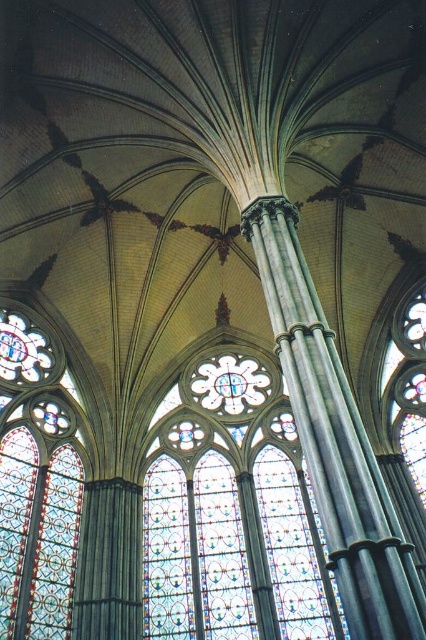
Is stained glass at center positioned at the back of polished stone column at center?

That is True.

Between stained glass at center and polished stone column at center, which one appears on the left side from the viewer's perspective?

From the viewer's perspective, stained glass at center appears more on the left side.

You are a GUI agent. You are given a task and a screenshot of the screen. Output one action in this format:
    pyautogui.click(x=<x>, y=<y>)
    Task: Click on the stained glass at center
    Image resolution: width=426 pixels, height=640 pixels.
    Given the screenshot: What is the action you would take?
    232,512

Between polished stone column at center and stained glass window at left, which one is positioned lower?

stained glass window at left is below.

Can you confirm if polished stone column at center is positioned to the right of stained glass window at left?

Yes, polished stone column at center is to the right of stained glass window at left.

Is point (339, 548) in front of point (37, 465)?

Yes, point (339, 548) is in front of point (37, 465).

What are the coordinates of `polished stone column at center` in the screenshot? It's located at (334, 440).

Is stained glass at center positioned before stained glass window at left?

No, stained glass at center is behind stained glass window at left.

Does stained glass at center appear on the right side of stained glass window at left?

Indeed, stained glass at center is positioned on the right side of stained glass window at left.

What do you see at coordinates (232, 512) in the screenshot? This screenshot has width=426, height=640. I see `stained glass at center` at bounding box center [232, 512].

The width and height of the screenshot is (426, 640). Identify the location of stained glass at center. (232, 512).